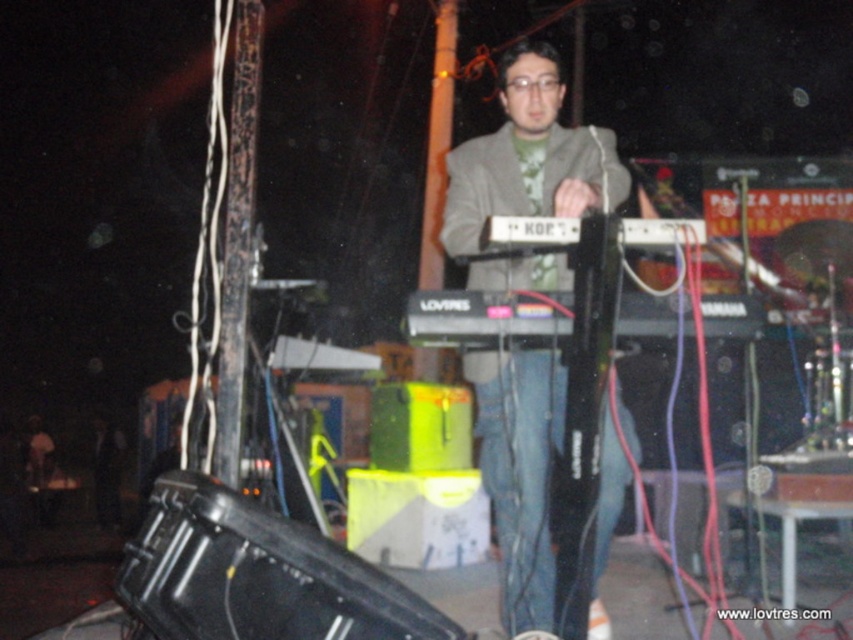
Between matte gray jacket at center and black plastic keyboard at center, which one is positioned lower?

matte gray jacket at center is lower down.

Who is positioned more to the left, matte gray jacket at center or black plastic keyboard at center?

Positioned to the left is matte gray jacket at center.

The width and height of the screenshot is (853, 640). I want to click on matte gray jacket at center, so click(x=527, y=156).